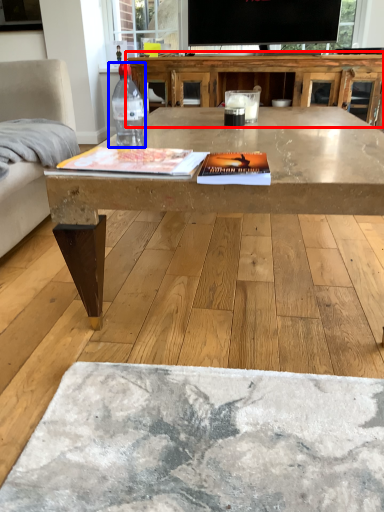
Question: Which object appears farthest to the camera in this image, table (highlighted by a red box) or bottle (highlighted by a blue box)?

Choices:
 (A) table
 (B) bottle

Answer: (A)